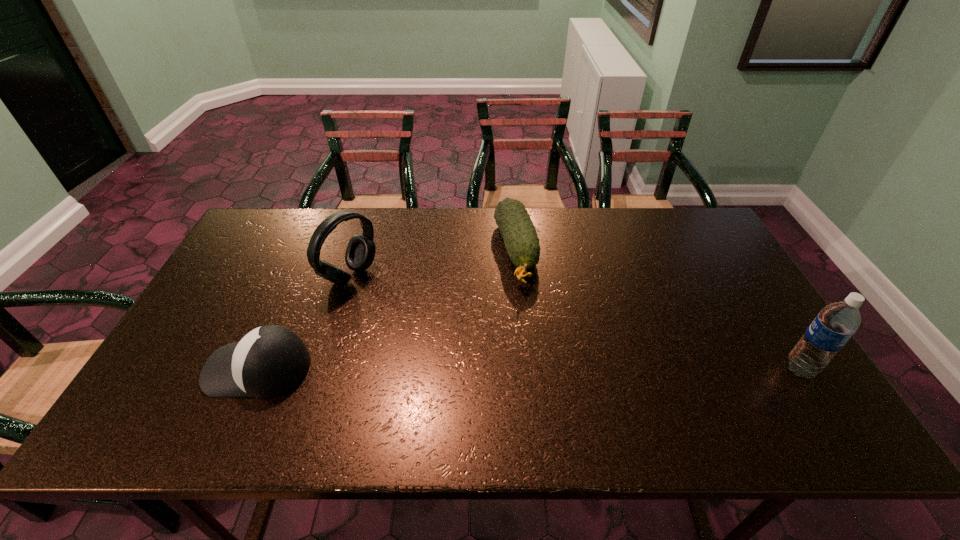
Where is `vacant area at the near edge of the desktop`? vacant area at the near edge of the desktop is located at coordinates (684, 397).

The width and height of the screenshot is (960, 540). Find the location of `vacant area at the left edge`. vacant area at the left edge is located at coordinates (209, 316).

You are a GUI agent. You are given a task and a screenshot of the screen. Output one action in this format:
    pyautogui.click(x=<x>, y=<y>)
    Task: Click on the free space at the far left corner of the desktop
    The width and height of the screenshot is (960, 540).
    Given the screenshot: What is the action you would take?
    pyautogui.click(x=282, y=213)

The image size is (960, 540). In order to click on free location at the near left corner of the desktop in this screenshot , I will do `click(142, 397)`.

Identify the location of blank area at the far right corner. This screenshot has height=540, width=960. (662, 218).

In order to click on vacant area between the cap and the second tallest object in this screenshot , I will do `click(304, 322)`.

Identify the location of free spot between the cap and the cucumber. (387, 310).

You are a GUI agent. You are given a task and a screenshot of the screen. Output one action in this format:
    pyautogui.click(x=<x>, y=<y>)
    Task: Click on the free space between the cucumber and the cap
    The height and width of the screenshot is (540, 960).
    Given the screenshot: What is the action you would take?
    pyautogui.click(x=387, y=310)

Identify the location of vacant area between the cap and the third shortest object. The image size is (960, 540). (304, 322).

At what (x,y) coordinates should I click in order to perform the action: click on vacant space in between the cap and the cucumber. Please return your answer as a coordinate pair (x, y). Looking at the image, I should click on (387, 310).